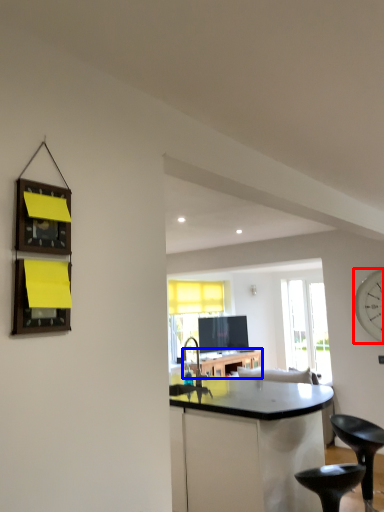
Question: Which object appears closest to the camera in this image, clock (highlighted by a red box) or table (highlighted by a blue box)?

Choices:
 (A) clock
 (B) table

Answer: (A)